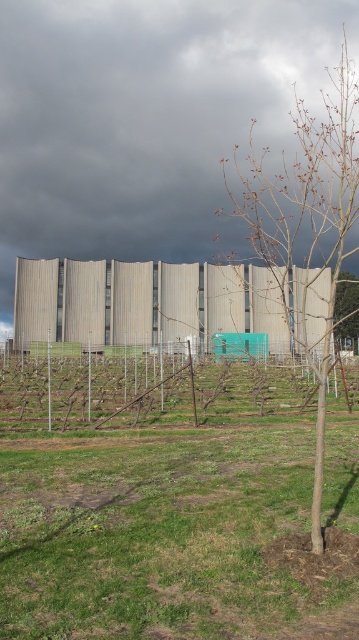
You are planning to install a small garden path between the green grass at center and the bare wood tree at right. Considering their widths, which one should you place the path closer to?

The green grass at center has a smaller width compared to the bare wood tree at right, so the path should be placed closer to the green grass at center to ensure proper spacing.